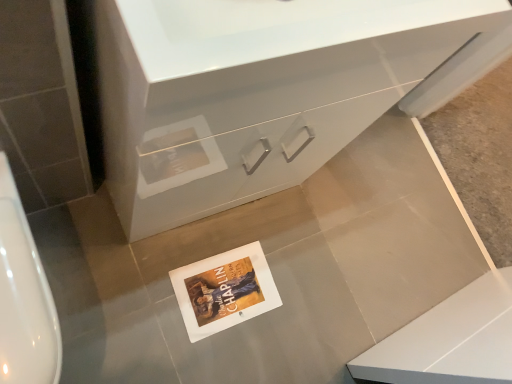
Locate an element on the screen. The image size is (512, 384). unoccupied region to the right of white paper postcard at center is located at coordinates (284, 333).